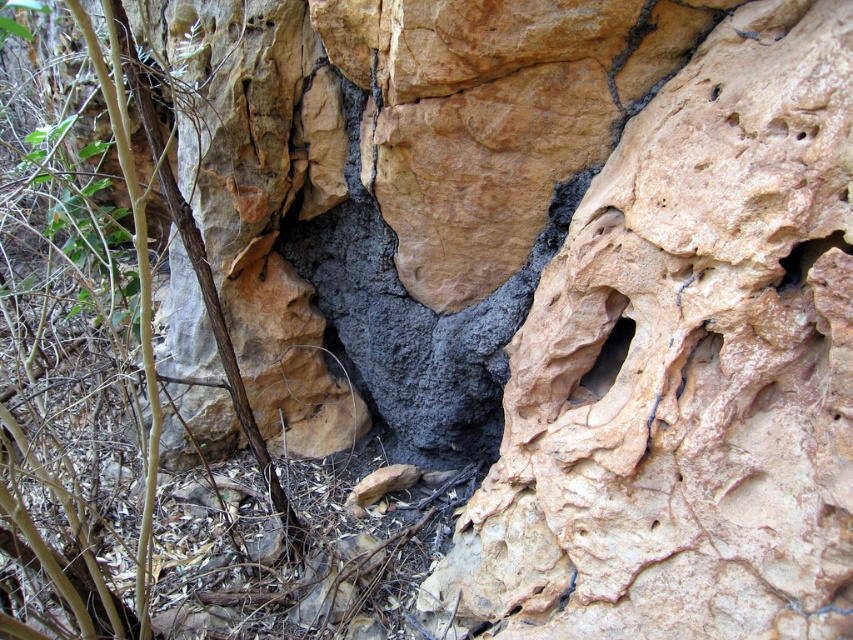
You are a geologist examining the rocky surface. You notice the smooth stone hole at center and the smooth gray rock at upper right. Which object is located above the other?

The smooth gray rock at upper right is above the smooth stone hole at center because it is positioned over it.

Consider the image. You are a geologist examining the rocky surface. You have a tool that can only fit through openings wider than the smooth gray rock at upper right. Will your tool fit into the smooth stone hole at center?

The smooth stone hole at center is wider than the smooth gray rock at upper right, so the tool will fit into the smooth stone hole at center if its width is less than the hole.